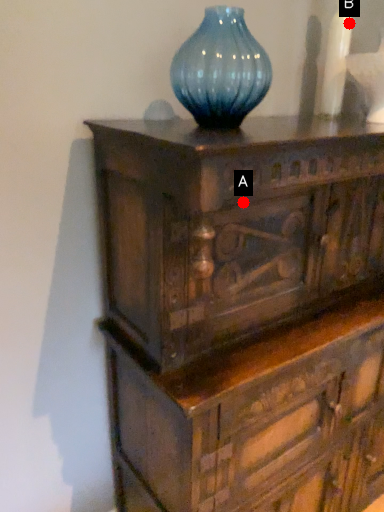
Question: Two points are circled on the image, labeled by A and B beside each circle. Among these points, which one is nearest to the camera?

Choices:
 (A) A is closer
 (B) B is closer

Answer: (A)